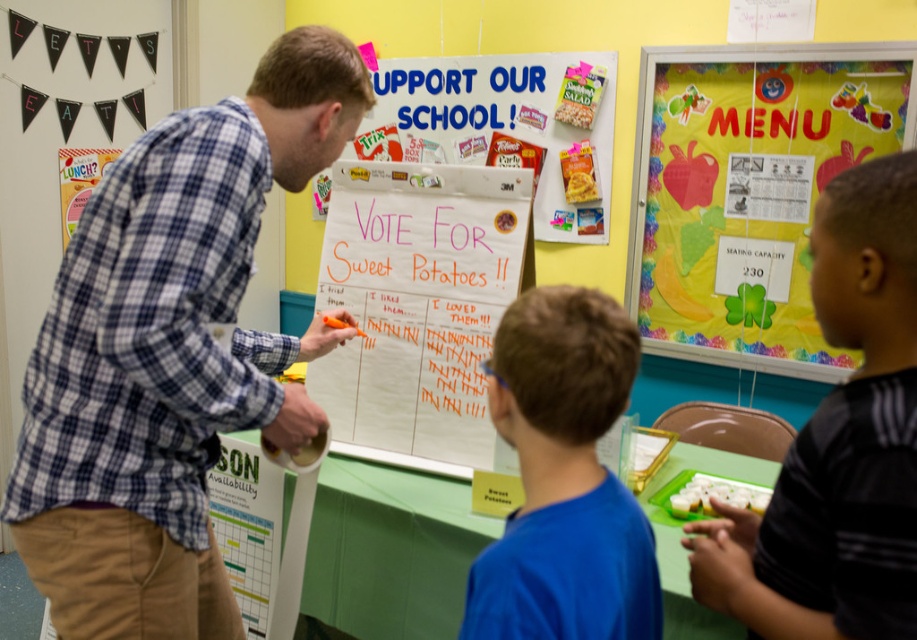
In the scene where a voting activity for sweet potatoes is happening, there is a blue plaid shirt at center and a green paper poster at lower left. Which object is taller?

The blue plaid shirt at center is taller than the green paper poster at lower left.

You are standing in the school cafeteria and see the blue plaid shirt at center and the green paper poster at lower left. Which object is located to the right of the other?

The blue plaid shirt at center is positioned on the right side of green paper poster at lower left.

You are a participant in the voting activity and want to place your vote. Which object should you approach first, the blue plaid shirt at center or the colorful paper menu at upper right?

You should approach the blue plaid shirt at center first because it is closer to you than the colorful paper menu at upper right.